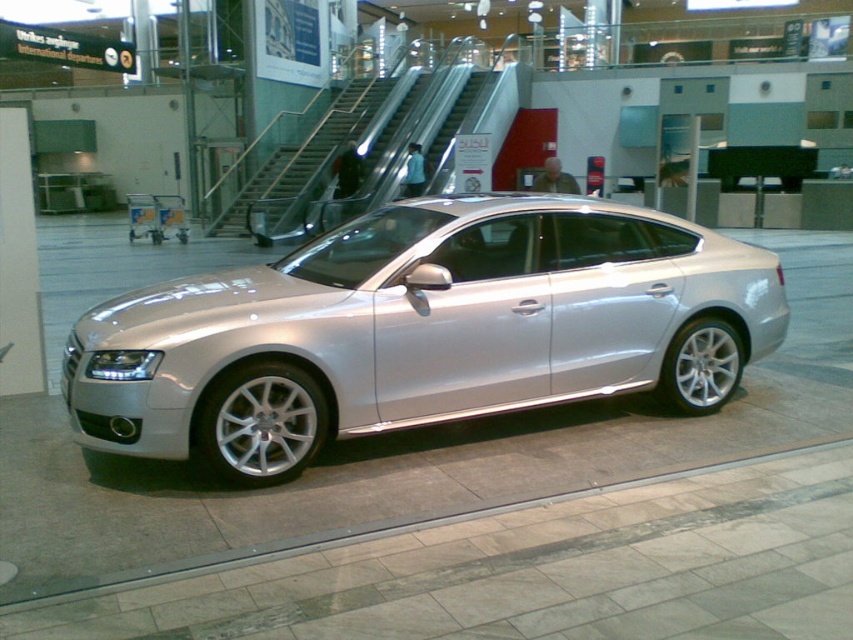
Which is in front, point (438, 410) or point (392, 188)?

Point (438, 410) is in front.

Between point (440, 372) and point (463, 93), which one is positioned behind?

The point (463, 93) is more distant.

Locate an element on the screen. This screenshot has width=853, height=640. silver metallic car at center is located at coordinates (421, 330).

You are a GUI agent. You are given a task and a screenshot of the screen. Output one action in this format:
    pyautogui.click(x=<x>, y=<y>)
    Task: Click on the silver metallic car at center
    
    Given the screenshot: What is the action you would take?
    pyautogui.click(x=421, y=330)